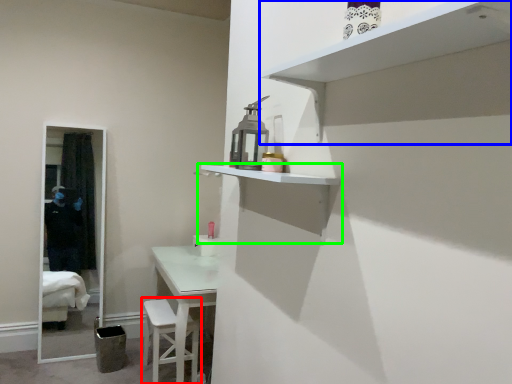
Question: Based on their relative distances, which object is farther from step stool (highlighted by a red box)? Choose from shelf (highlighted by a blue box) and shelf (highlighted by a green box).

Choices:
 (A) shelf
 (B) shelf

Answer: (A)